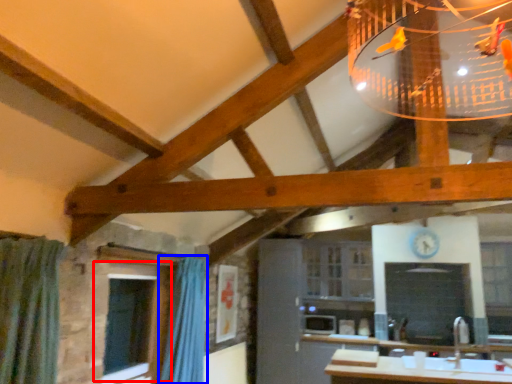
Question: Among these objects, which one is farthest to the camera, window (highlighted by a red box) or shower curtain (highlighted by a blue box)?

Choices:
 (A) window
 (B) shower curtain

Answer: (B)